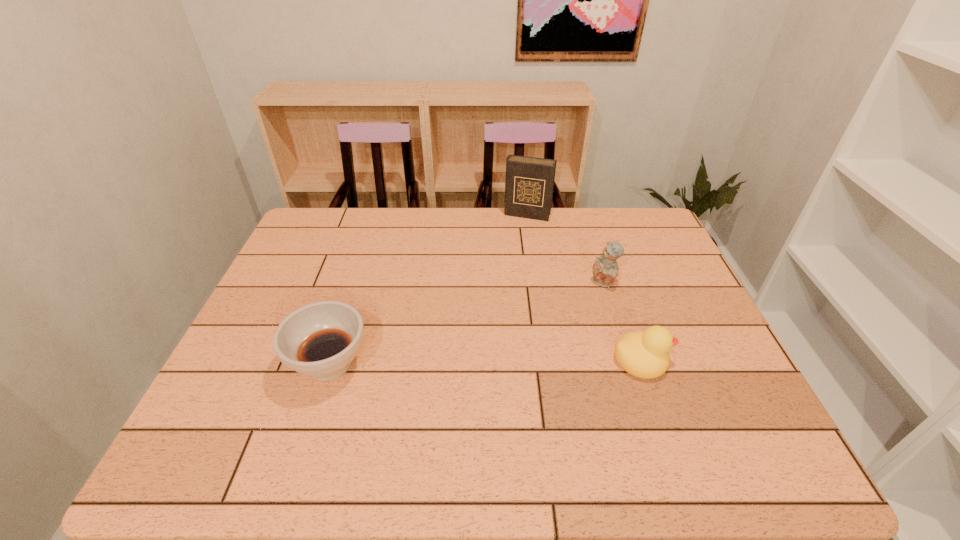
Where is `free space located on the front cover of the third object from right to left`? This screenshot has height=540, width=960. free space located on the front cover of the third object from right to left is located at coordinates [516, 241].

I want to click on free space located on the front-facing side of the teddy bear, so click(526, 338).

I want to click on free space located on the front-facing side of the teddy bear, so (x=503, y=354).

This screenshot has height=540, width=960. Identify the location of free space located 0.200m on the front-facing side of the teddy bear. 547,322.

The image size is (960, 540). In order to click on object present at the far edge in this screenshot , I will do `click(529, 183)`.

This screenshot has height=540, width=960. I want to click on object at the near edge, so click(320, 340).

At what (x,y) coordinates should I click in order to perform the action: click on object located at the left edge. Please return your answer as a coordinate pair (x, y). This screenshot has width=960, height=540. Looking at the image, I should click on pyautogui.click(x=320, y=340).

Identify the location of object present at the right edge. (644, 354).

Locate an element on the screen. This screenshot has height=540, width=960. object present at the near left corner is located at coordinates (320, 340).

The height and width of the screenshot is (540, 960). In order to click on vacant space at the far edge of the desktop in this screenshot , I will do `click(457, 235)`.